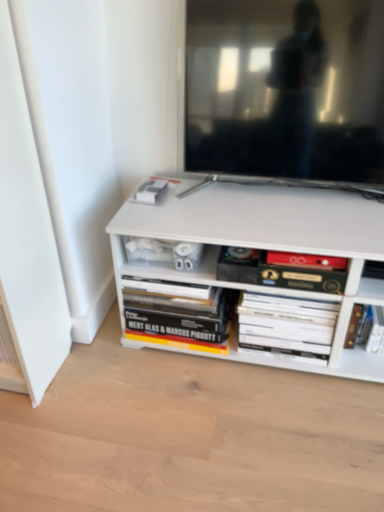
This screenshot has height=512, width=384. What are the coordinates of `white matte book at center, the third book positioned from the left` in the screenshot? It's located at (286, 325).

The width and height of the screenshot is (384, 512). What do you see at coordinates (180, 314) in the screenshot?
I see `hardcover book at lower center, which is the 1th book from left to right` at bounding box center [180, 314].

The width and height of the screenshot is (384, 512). Describe the element at coordinates (276, 272) in the screenshot. I see `hardcover book at center, which is the third book in right-to-left order` at that location.

Where is `white matte book at center, the third book positioned from the left`? white matte book at center, the third book positioned from the left is located at coordinates (286, 325).

Considering the positions of objects white matte book at center, the third book positioned from the left, and hardcover book at lower center, which is the fourth book in right-to-left order, in the image provided, who is more to the right, white matte book at center, the third book positioned from the left, or hardcover book at lower center, which is the fourth book in right-to-left order,?

From the viewer's perspective, white matte book at center, the third book positioned from the left, appears more on the right side.

Is there a large distance between white matte book at center, the third book positioned from the left, and hardcover book at lower center, which is the fourth book in right-to-left order?

white matte book at center, the third book positioned from the left, is actually quite close to hardcover book at lower center, which is the fourth book in right-to-left order.

From the image's perspective, does white matte book at center, the third book positioned from the left, appear lower than hardcover book at lower center, which is the 1th book from left to right?

Correct, white matte book at center, the third book positioned from the left, appears lower than hardcover book at lower center, which is the 1th book from left to right, in the image.

Locate an element on the screen. the 1st book above the white matte book at center, the third book positioned from the left (from the image's perspective) is located at coordinates (180, 314).

Considering the positions of objects matte black tv at upper center and hardcover book at lower center, which is the fourth book in right-to-left order, in the image provided, who is more to the left, matte black tv at upper center or hardcover book at lower center, which is the fourth book in right-to-left order,?

hardcover book at lower center, which is the fourth book in right-to-left order.

From the image's perspective, is matte black tv at upper center above or below hardcover book at lower center, which is the 1th book from left to right?

matte black tv at upper center is above hardcover book at lower center, which is the 1th book from left to right.

Considering the relative positions of matte black tv at upper center and hardcover book at lower center, which is the 1th book from left to right, in the image provided, is matte black tv at upper center in front of hardcover book at lower center, which is the 1th book from left to right,?

That is True.

Could you tell me if matte black tv at upper center is facing hardcover book at lower center, which is the fourth book in right-to-left order?

No, matte black tv at upper center does not turn towards hardcover book at lower center, which is the fourth book in right-to-left order.

In terms of size, does hardcover book at center, which is the third book in right-to-left order, appear bigger or smaller than hardcover book at lower center, which is the fourth book in right-to-left order?

In the image, hardcover book at center, which is the third book in right-to-left order, appears to be smaller than hardcover book at lower center, which is the fourth book in right-to-left order.

How much distance is there between hardcover book at center, which is the third book in right-to-left order, and hardcover book at lower center, which is the 1th book from left to right?

hardcover book at center, which is the third book in right-to-left order, and hardcover book at lower center, which is the 1th book from left to right, are 9.21 inches apart.

Who is shorter, hardcover book at center, which is the 2th book from left to right, or hardcover book at lower center, which is the fourth book in right-to-left order?

hardcover book at center, which is the 2th book from left to right.

Starting from the hardcover book at center, which is the 2th book from left to right, which book is the 2nd one behind? Please provide its 2D coordinates.

[(180, 314)]

Can you confirm if hardcover book at lower center, which is the fourth book in right-to-left order, is shorter than hardcover book at center, which is the third book in right-to-left order?

No, hardcover book at lower center, which is the fourth book in right-to-left order, is not shorter than hardcover book at center, which is the third book in right-to-left order.

From a real-world perspective, is hardcover book at lower center, which is the fourth book in right-to-left order, positioned under hardcover book at center, which is the third book in right-to-left order, based on gravity?

Yes, from a real-world perspective, hardcover book at lower center, which is the fourth book in right-to-left order, is below hardcover book at center, which is the third book in right-to-left order.

Between hardcover book at lower center, which is the 1th book from left to right, and hardcover book at center, which is the 2th book from left to right, which one appears on the right side from the viewer's perspective?

Positioned to the right is hardcover book at center, which is the 2th book from left to right.

Who is shorter, hardcover book at center, which is the third book in right-to-left order, or white matte book at center, the third book positioned from the left?

With less height is hardcover book at center, which is the third book in right-to-left order.

From a real-world perspective, which is physically below, hardcover book at center, which is the third book in right-to-left order, or white matte book at center, the third book positioned from the left?

In real-world perspective, white matte book at center, the third book positioned from the left, is lower.

Is hardcover book at center, which is the 2th book from left to right, not inside white matte book at center, which is the 2th book from right to left?

hardcover book at center, which is the 2th book from left to right, lies outside white matte book at center, which is the 2th book from right to left,'s area.

Would you consider hardcover book at center, which is the third book in right-to-left order, to be distant from white matte book at center, which is the 2th book from right to left?

No, hardcover book at center, which is the third book in right-to-left order, is in close proximity to white matte book at center, which is the 2th book from right to left.

Is hardcover book at lower right, which is the 1th book in right-to-left order, completely or partially outside of matte black tv at upper center?

hardcover book at lower right, which is the 1th book in right-to-left order, lies outside matte black tv at upper center's area.

Considering the relative positions of hardcover book at lower right, positioned as the 4th book in left-to-right order, and matte black tv at upper center in the image provided, is hardcover book at lower right, positioned as the 4th book in left-to-right order, to the left of matte black tv at upper center from the viewer's perspective?

No, hardcover book at lower right, positioned as the 4th book in left-to-right order, is not to the left of matte black tv at upper center.

Considering the sizes of objects hardcover book at lower right, which is the 1th book in right-to-left order, and matte black tv at upper center in the image provided, who is smaller, hardcover book at lower right, which is the 1th book in right-to-left order, or matte black tv at upper center?

hardcover book at lower right, which is the 1th book in right-to-left order, is smaller.

Can you confirm if white matte book at center, the third book positioned from the left, is smaller than matte black tv at upper center?

Yes, white matte book at center, the third book positioned from the left, is smaller than matte black tv at upper center.

Between white matte book at center, the third book positioned from the left, and matte black tv at upper center, which one is positioned behind?

white matte book at center, the third book positioned from the left, is further from the camera.

How different are the orientations of white matte book at center, the third book positioned from the left, and matte black tv at upper center in degrees?

The facing directions of white matte book at center, the third book positioned from the left, and matte black tv at upper center are 0.0142 degrees apart.

Is white matte book at center, which is the 2th book from right to left, far away from matte black tv at upper center?

Actually, white matte book at center, which is the 2th book from right to left, and matte black tv at upper center are a little close together.

From the hardcover book at lower center, which is the 1th book from left to right, count 1st books forward and point to it. Please provide its 2D coordinates.

[(286, 325)]

Image resolution: width=384 pixels, height=512 pixels. I want to click on television on the right of hardcover book at lower center, which is the 1th book from left to right, so click(x=286, y=88).

Based on their spatial positions, is hardcover book at center, which is the third book in right-to-left order, or hardcover book at lower right, positioned as the 4th book in left-to-right order, further from matte black tv at upper center?

hardcover book at lower right, positioned as the 4th book in left-to-right order.

Looking at the image, which one is located further to white matte book at center, which is the 2th book from right to left, hardcover book at center, which is the third book in right-to-left order, or hardcover book at lower center, which is the fourth book in right-to-left order?

hardcover book at lower center, which is the fourth book in right-to-left order, is further to white matte book at center, which is the 2th book from right to left.

Estimate the real-world distances between objects in this image. Which object is closer to hardcover book at center, which is the 2th book from left to right, hardcover book at lower right, which is the 1th book in right-to-left order, or matte black tv at upper center?

hardcover book at lower right, which is the 1th book in right-to-left order, is positioned closer to the anchor hardcover book at center, which is the 2th book from left to right.

Looking at the image, which one is located closer to white matte book at center, which is the 2th book from right to left, hardcover book at center, which is the 2th book from left to right, or hardcover book at lower right, positioned as the 4th book in left-to-right order?

Among the two, hardcover book at center, which is the 2th book from left to right, is located nearer to white matte book at center, which is the 2th book from right to left.

Estimate the real-world distances between objects in this image. Which object is closer to matte black tv at upper center, hardcover book at lower center, which is the 1th book from left to right, or hardcover book at center, which is the 2th book from left to right?

Based on the image, hardcover book at center, which is the 2th book from left to right, appears to be nearer to matte black tv at upper center.

From the image, which object appears to be farther from hardcover book at lower center, which is the fourth book in right-to-left order, matte black tv at upper center or hardcover book at center, which is the third book in right-to-left order?

matte black tv at upper center is positioned further to the anchor hardcover book at lower center, which is the fourth book in right-to-left order.

Which object lies further to the anchor point hardcover book at lower right, which is the 1th book in right-to-left order, hardcover book at lower center, which is the fourth book in right-to-left order, or matte black tv at upper center?

matte black tv at upper center.

Based on their spatial positions, is hardcover book at center, which is the third book in right-to-left order, or hardcover book at lower right, which is the 1th book in right-to-left order, further from hardcover book at lower center, which is the fourth book in right-to-left order?

hardcover book at lower right, which is the 1th book in right-to-left order, is further to hardcover book at lower center, which is the fourth book in right-to-left order.

Locate an element on the screen. The width and height of the screenshot is (384, 512). television between hardcover book at lower center, which is the 1th book from left to right, and hardcover book at lower right, which is the 1th book in right-to-left order, from left to right is located at coordinates (286, 88).

I want to click on book between matte black tv at upper center and hardcover book at lower center, which is the fourth book in right-to-left order, in the vertical direction, so click(x=276, y=272).

The height and width of the screenshot is (512, 384). I want to click on book situated between hardcover book at lower center, which is the 1th book from left to right, and white matte book at center, which is the 2th book from right to left, from left to right, so click(276, 272).

Identify the location of book located between hardcover book at center, which is the third book in right-to-left order, and hardcover book at lower right, which is the 1th book in right-to-left order, in the left-right direction. (286, 325).